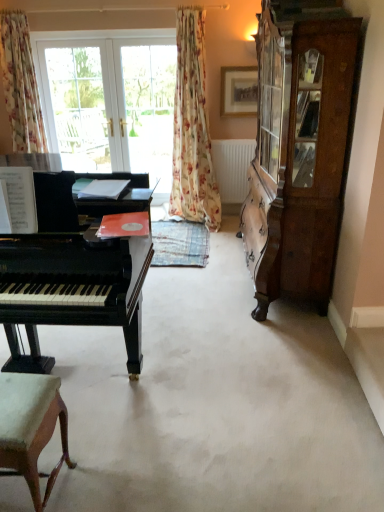
Question: From a real-world perspective, is floral fabric curtain at center, the 2th curtain when ordered from left to right, physically located above or below white matte radiator at center?

Choices:
 (A) below
 (B) above

Answer: (B)

Question: In terms of height, does floral fabric curtain at center, the 2th curtain when ordered from left to right, look taller or shorter compared to white matte radiator at center?

Choices:
 (A) tall
 (B) short

Answer: (A)

Question: Estimate the real-world distances between objects in this image. Which object is closer to the floral fabric curtain at left, which is counted as the 1th curtain, starting from the left?

Choices:
 (A) wooden cabinet at right
 (B) transparent glass door at upper center, which appears as the 2th screen door when viewed from the left
 (C) light brown wood chair at lower left
 (D) shiny black piano at left
 (E) floral fabric curtain at center, the 2th curtain when ordered from left to right

Answer: (B)

Question: Estimate the real-world distances between objects in this image. Which object is farther from the wooden cabinet at right?

Choices:
 (A) floral fabric curtain at center, the 2th curtain when ordered from left to right
 (B) transparent glass door at upper left, positioned as the second screen door in right-to-left order
 (C) wooden picture frame at upper center
 (D) light brown wood chair at lower left
 (E) transparent glass door at upper center, which appears as the 2th screen door when viewed from the left

Answer: (B)